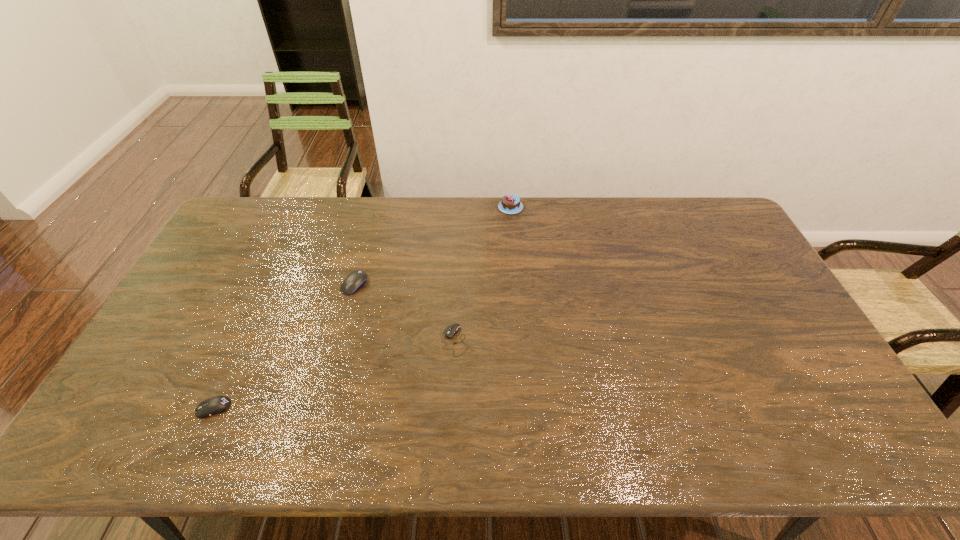
This screenshot has width=960, height=540. I want to click on blank space located on the back of the leftmost computer mouse, so click(242, 346).

Locate an element on the screen. free point located 0.170m on the back of the rightmost computer mouse is located at coordinates (458, 282).

At what (x,y) coordinates should I click in order to perform the action: click on object that is positioned at the far edge. Please return your answer as a coordinate pair (x, y). This screenshot has height=540, width=960. Looking at the image, I should click on (510, 204).

In the image, there is a desktop. Where is `free region at the far edge`? This screenshot has width=960, height=540. free region at the far edge is located at coordinates click(435, 198).

Find the location of `free region at the near edge`. free region at the near edge is located at coordinates 200,430.

The width and height of the screenshot is (960, 540). I want to click on vacant space at the left edge, so click(252, 239).

Where is `free space at the far right corner of the desktop`? This screenshot has width=960, height=540. free space at the far right corner of the desktop is located at coordinates (684, 199).

Where is `free spot between the second computer mouse from left to right and the shortest computer mouse`? The width and height of the screenshot is (960, 540). free spot between the second computer mouse from left to right and the shortest computer mouse is located at coordinates click(405, 313).

I want to click on vacant point located between the second object from left to right and the third object from left to right, so click(405, 313).

Where is `unoccupied area between the second shortest object and the second farthest object`? unoccupied area between the second shortest object and the second farthest object is located at coordinates (284, 346).